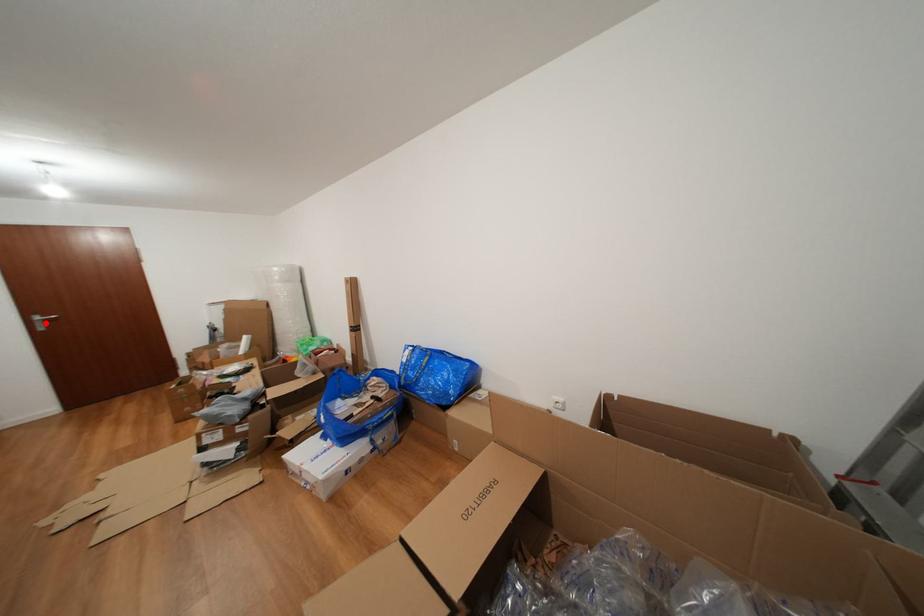
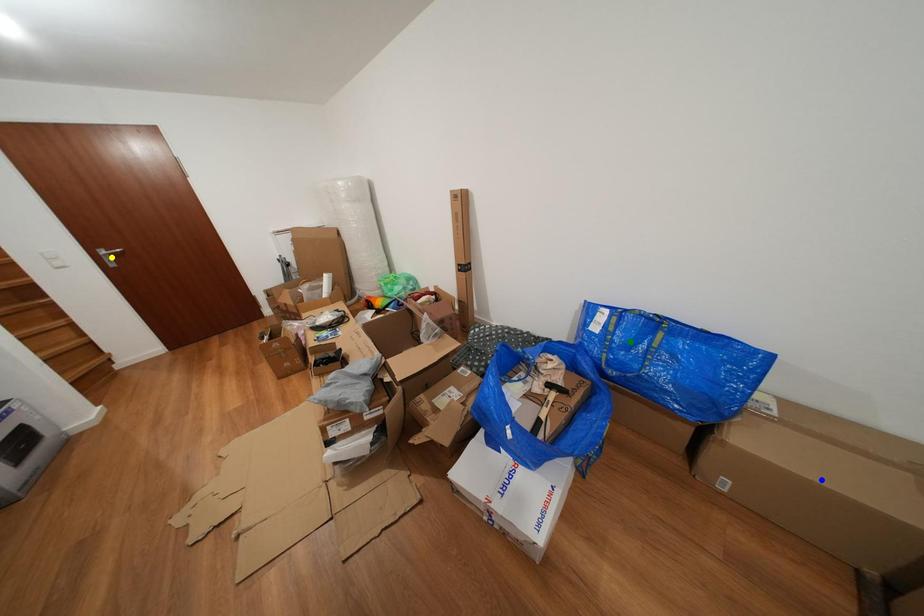
Question: I am providing you with two images of the same scene from different viewpoints. A red point is marked on the first image. You are given multiple points on the second image. In image 2, which mark is for the same physical point as the one in image 1?

Choices:
 (A) yellow point
 (B) green point
 (C) blue point

Answer: (A)